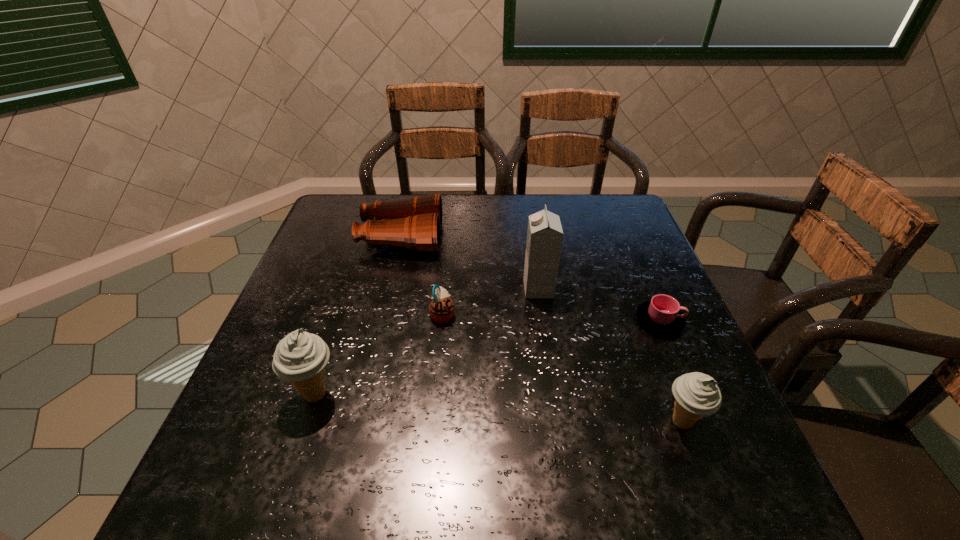
To achieve uniform spacing by inserting another icecream among them, please point to a free space for this new icecream. Please provide its 2D coordinates. Your answer should be formatted as a tuple, i.e. [(x, y)], where the tuple contains the x and y coordinates of a point satisfying the conditions above.

[(494, 408)]